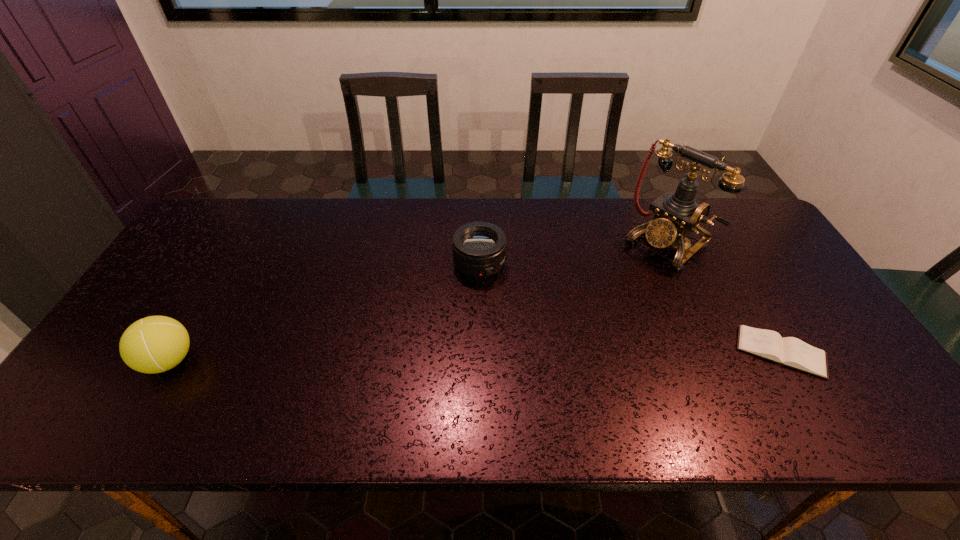
This screenshot has width=960, height=540. I want to click on object that is at the near right corner, so click(789, 351).

Find the location of a particular element. The width and height of the screenshot is (960, 540). vacant space at the far edge of the desktop is located at coordinates (350, 220).

Image resolution: width=960 pixels, height=540 pixels. In order to click on vacant space at the near edge of the desktop in this screenshot , I will do `click(155, 394)`.

This screenshot has height=540, width=960. Find the location of `free location at the far left corner`. free location at the far left corner is located at coordinates (237, 203).

Where is `vacant area at the near right corner`? Image resolution: width=960 pixels, height=540 pixels. vacant area at the near right corner is located at coordinates (834, 386).

Identify the location of free space between the tallest object and the tennis ball. (418, 302).

This screenshot has height=540, width=960. I want to click on free area in between the leftmost object and the diary, so click(x=475, y=356).

The width and height of the screenshot is (960, 540). Find the location of `vacant space that's between the tallest object and the third shortest object`. vacant space that's between the tallest object and the third shortest object is located at coordinates (418, 302).

Where is `free area in between the telephone and the tennis ball`? free area in between the telephone and the tennis ball is located at coordinates (418, 302).

Locate an element on the screen. This screenshot has width=960, height=540. unoccupied area between the third tallest object and the shortest object is located at coordinates (630, 308).